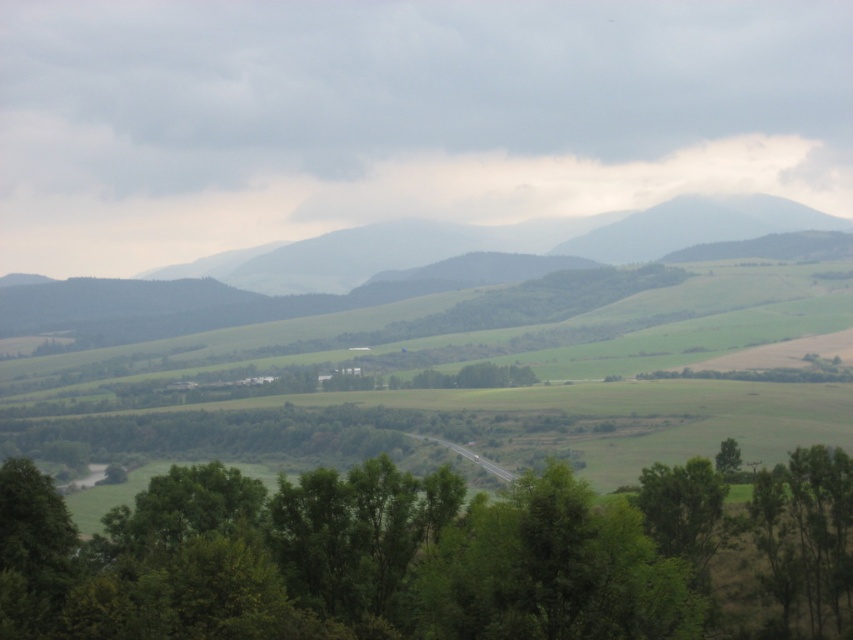
Is point (85, 556) positioned after point (717, 241)?

No, (85, 556) is closer to viewer.

Between point (784, 618) and point (265, 259), which one is positioned in front?

Point (784, 618) is in front.

Where is `green leafy tree at center`? The height and width of the screenshot is (640, 853). green leafy tree at center is located at coordinates (419, 556).

Does green grassy hill at center appear on the right side of green leafy tree at lower right?

No, green grassy hill at center is not to the right of green leafy tree at lower right.

Based on the photo, does green grassy hill at center appear on the left side of green leafy tree at lower right?

Correct, you'll find green grassy hill at center to the left of green leafy tree at lower right.

I want to click on green grassy hill at center, so click(500, 243).

Find the location of `green grassy hill at center`. green grassy hill at center is located at coordinates (500, 243).

Who is positioned more to the right, green leafy tree at center or green leafy tree at lower right?

Positioned to the right is green leafy tree at lower right.

In the scene shown: Who is more forward, (643,513) or (732,476)?

Point (643,513)

Describe the element at coordinates (419, 556) in the screenshot. This screenshot has width=853, height=640. I see `green leafy tree at center` at that location.

Find the location of a particular element. green leafy tree at center is located at coordinates (419, 556).